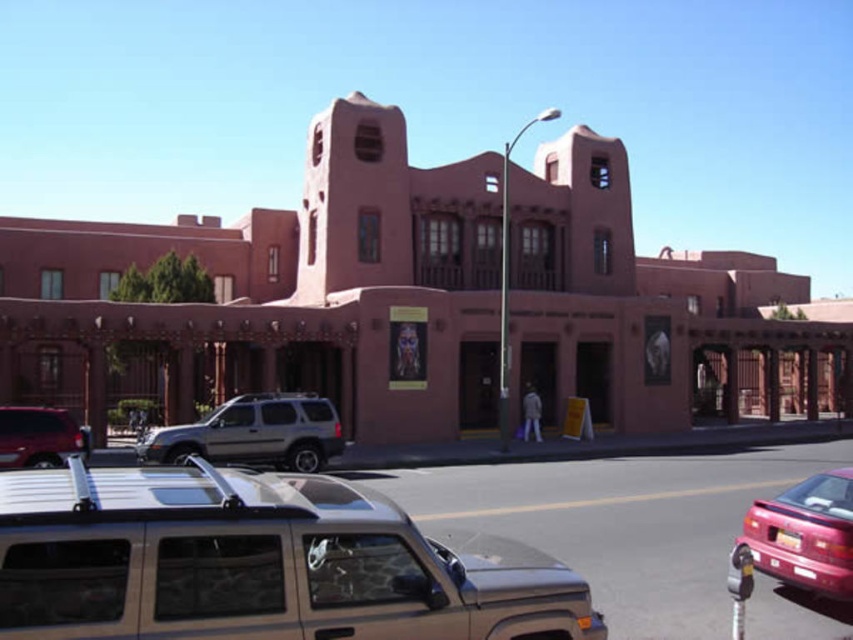
You are standing in front of the building and want to take a photo that includes both the silver SUV and the maroon sedan. The silver SUV is at point (59, 602) and the maroon sedan is at point (740, 577). Which vehicle should you focus on first to ensure both are in the frame?

You should focus on the silver SUV at point (59, 602) first because it is closer to the camera than the maroon sedan at point (740, 577), ensuring both vehicles are within the frame.

You are standing in front of the building and want to park your car. You see a silver metallic minivan at center and a metallic parking meter at lower right. Which object is nearer to you?

The silver metallic minivan at center is closer to the viewer than the metallic parking meter at lower right, so the minivan is nearer.

You are a delivery driver who needs to park your vehicle between the silver metallic minivan at center and the matte silver suv at lower left. Which side of the parking spot should you choose to ensure you are parked between them?

You should park on the right side of the parking spot because the silver metallic minivan at center is to the right of the matte silver suv at lower left, so positioning yourself between them would require being to the right of the suv and left of the minivan.